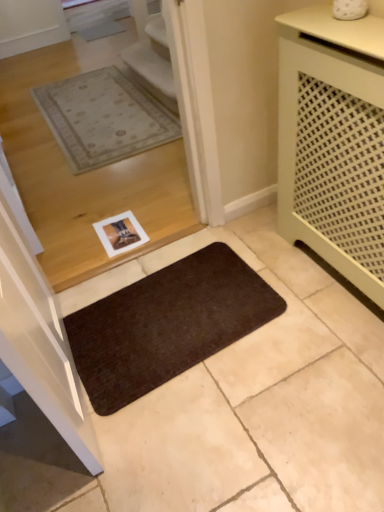
Locate an element on the screen. free space that is in between matte green cabinet at right and brown matte mat at lower center is located at coordinates (263, 326).